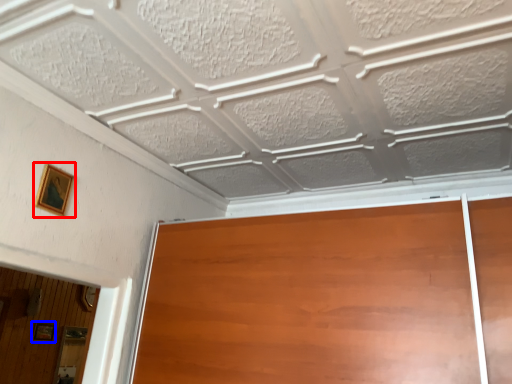
Question: Among these objects, which one is farthest to the camera, picture frame (highlighted by a red box) or picture frame (highlighted by a blue box)?

Choices:
 (A) picture frame
 (B) picture frame

Answer: (B)